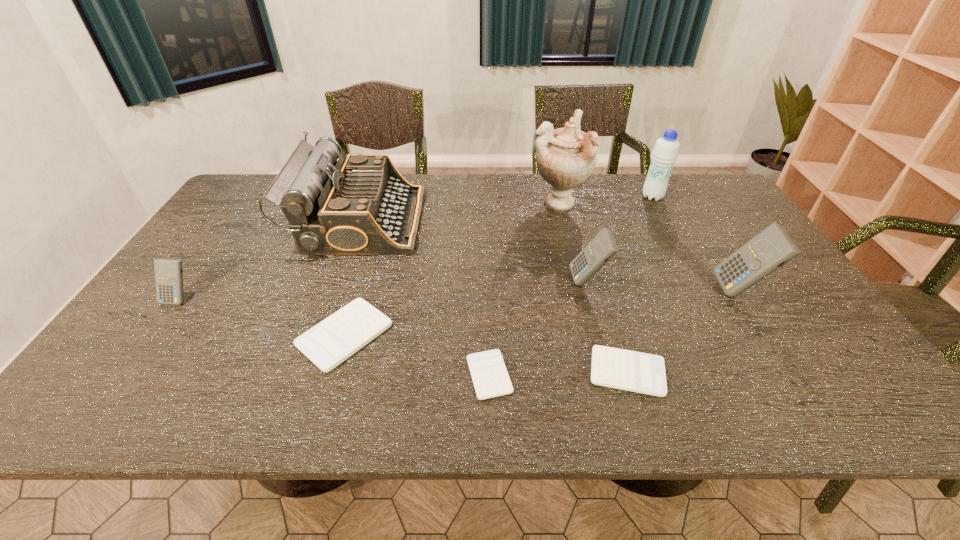
Locate an element on the screen. This screenshot has width=960, height=540. the second calculator from left to right is located at coordinates (336, 338).

The image size is (960, 540). Find the location of `the second shortest object`. the second shortest object is located at coordinates (622, 369).

The image size is (960, 540). I want to click on the rightmost white calculator, so click(x=622, y=369).

Find the location of a particular element. Image resolution: width=960 pixels, height=540 pixels. the fourth object from left to right is located at coordinates (489, 374).

At what (x,y) coordinates should I click in order to perform the action: click on the shortest calculator. Please return your answer as a coordinate pair (x, y). Looking at the image, I should click on (489, 374).

Where is `free space located 0.050m on the right of the tallest object`? free space located 0.050m on the right of the tallest object is located at coordinates (602, 202).

At what (x,y) coordinates should I click in order to perform the action: click on vacant region located 0.150m on the right of the blue water bottle. Please return your answer as a coordinate pair (x, y). This screenshot has height=540, width=960. Looking at the image, I should click on (708, 197).

I want to click on vacant position located 0.190m on the keyboard of the typewriter, so click(480, 220).

Locate an element on the screen. Image resolution: width=960 pixels, height=540 pixels. free location located on the front-facing side of the biggest blue calculator is located at coordinates (671, 291).

At what (x,y) coordinates should I click in order to perform the action: click on vacant space located on the front-facing side of the biggest blue calculator. Please return your answer as a coordinate pair (x, y). This screenshot has width=960, height=540. Looking at the image, I should click on (675, 291).